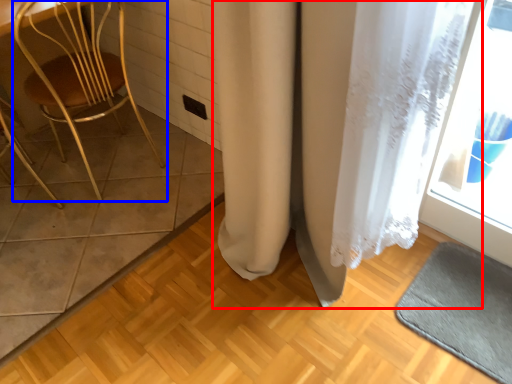
Question: Which object is closer to the camera taking this photo, curtain (highlighted by a red box) or chair (highlighted by a blue box)?

Choices:
 (A) curtain
 (B) chair

Answer: (A)